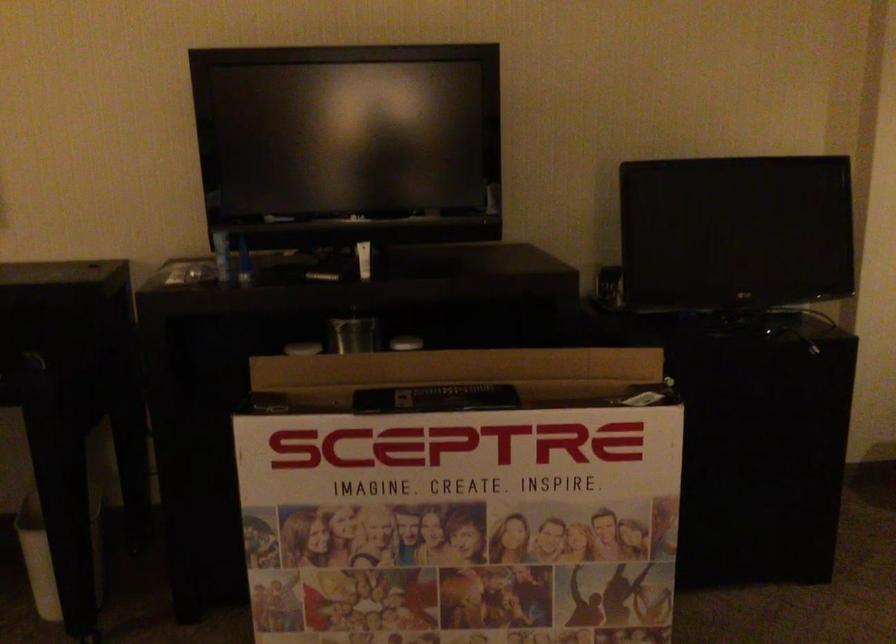
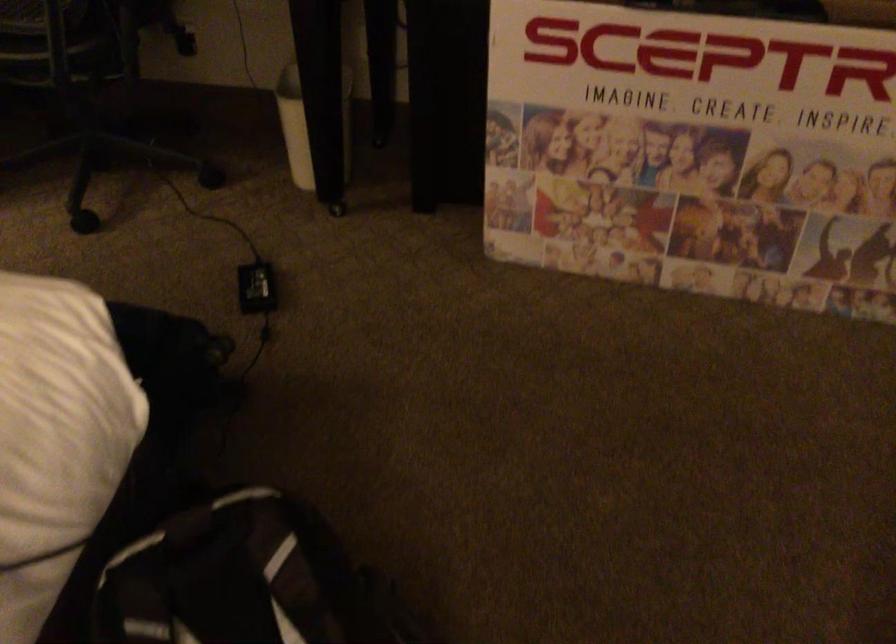
Find the pixel in the second image that matches (440,529) in the first image.

(692, 149)